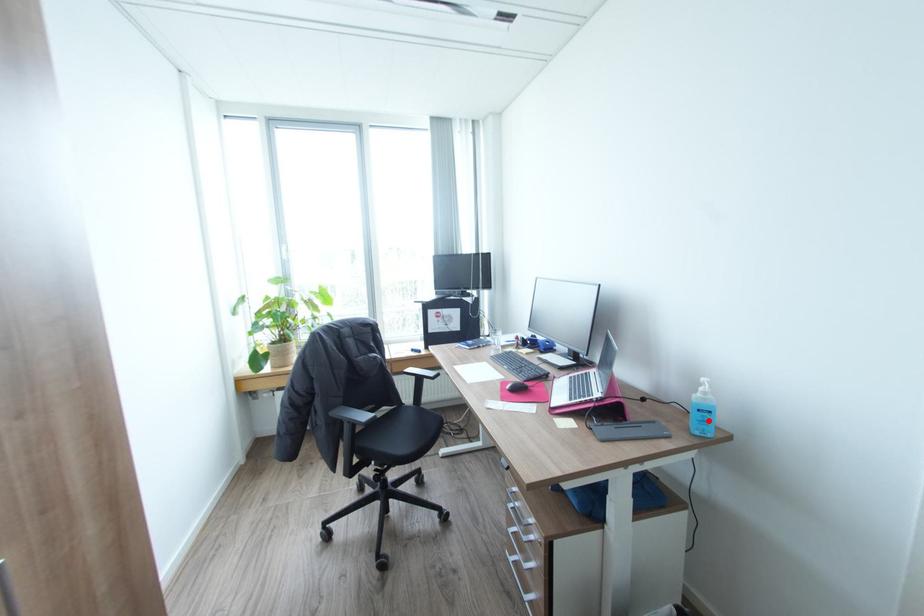
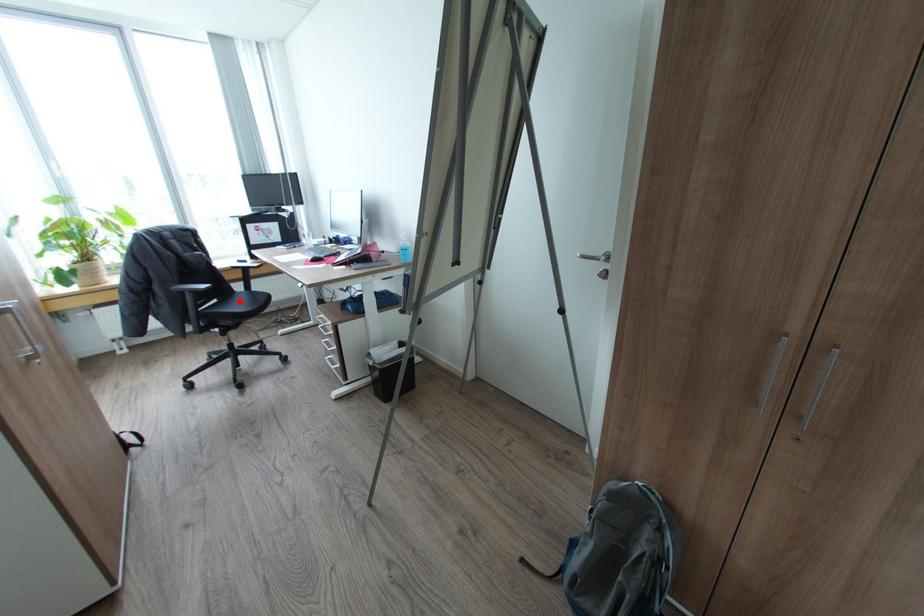
I am providing you with two images of the same scene from different viewpoints. A red point is marked on the first image and another point is marked on the second image. Do the highlighted points in image1 and image2 indicate the same real-world spot?

No